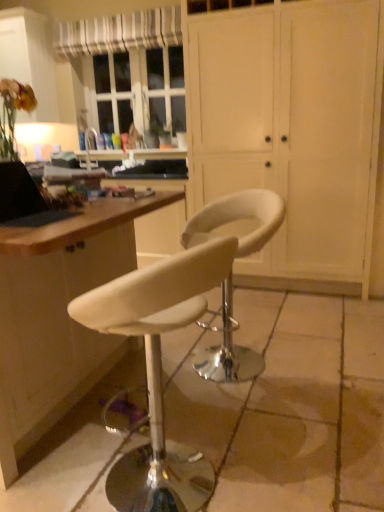
Find the location of `free space to the left of white leather stool at center, placed as the second chair when sorted from front to back`. free space to the left of white leather stool at center, placed as the second chair when sorted from front to back is located at coordinates (163, 368).